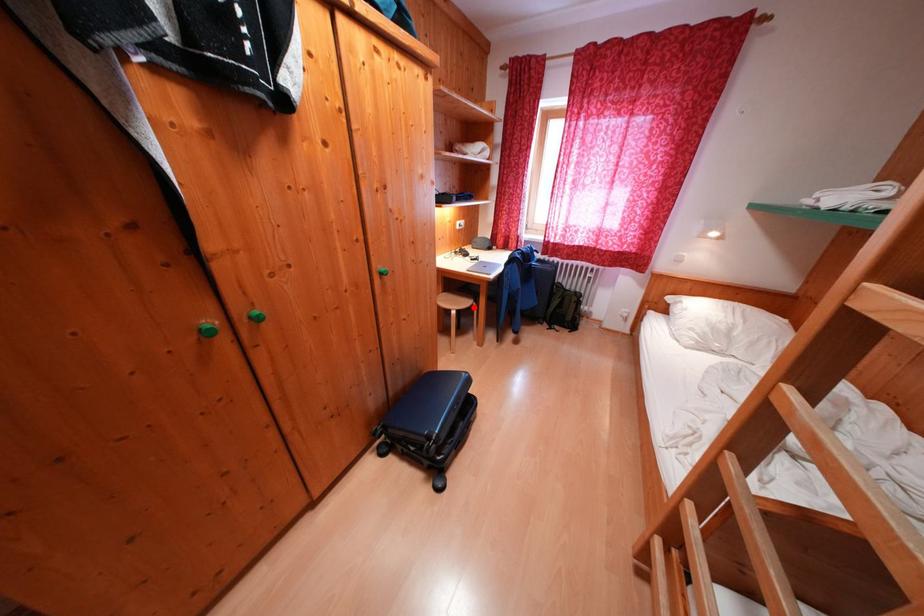
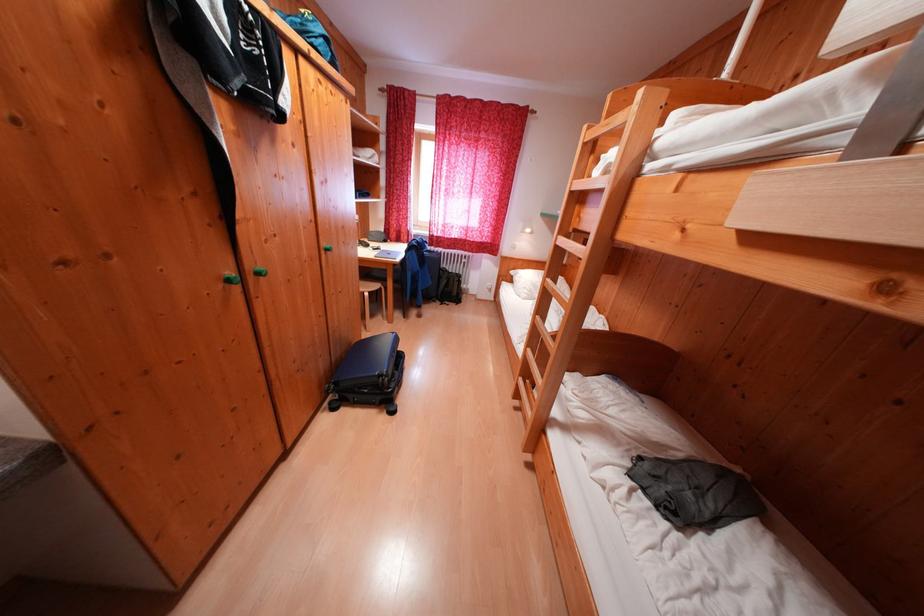
In the second image, find the point that corresponds to the highlighted location in the first image.

(383, 290)